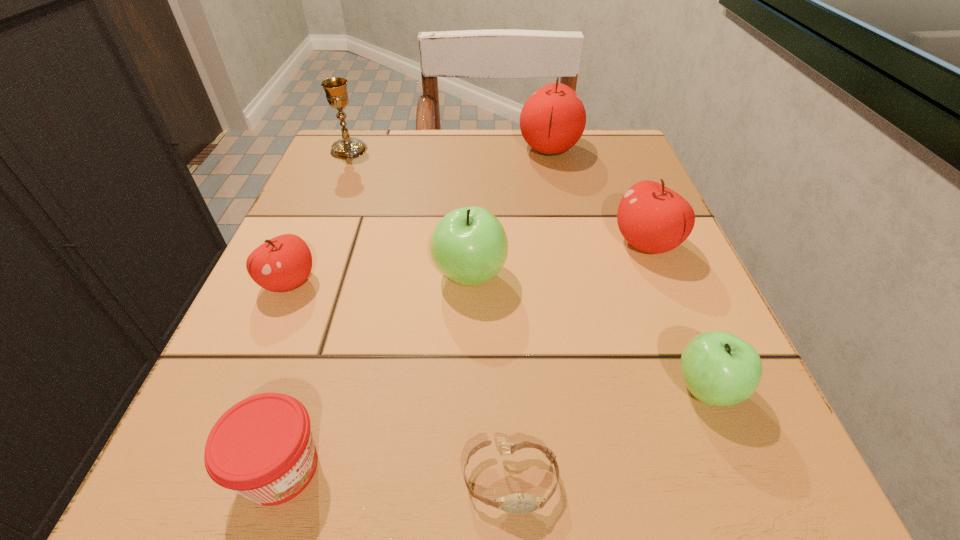
Identify the location of vacant point located between the red jam and the rightmost red apple. The width and height of the screenshot is (960, 540). (464, 355).

Locate an element on the screen. This screenshot has width=960, height=540. empty space that is in between the red jam and the nearer green apple is located at coordinates (493, 428).

You are a GUI agent. You are given a task and a screenshot of the screen. Output one action in this format:
    pyautogui.click(x=<x>, y=<y>)
    Task: Click on the vacant area that lies between the leftmost red apple and the jam
    This screenshot has height=540, width=960.
    Given the screenshot: What is the action you would take?
    pyautogui.click(x=285, y=375)

This screenshot has height=540, width=960. In order to click on free spot between the leftmost apple and the farthest red apple in this screenshot , I will do `click(420, 215)`.

Image resolution: width=960 pixels, height=540 pixels. What are the coordinates of `empty space that is in between the right green apple and the second biggest red apple` in the screenshot? It's located at (676, 316).

Locate an element on the screen. This screenshot has width=960, height=540. free space between the second biggest red apple and the red jam is located at coordinates (464, 355).

Find the location of `free area in between the shortest object and the farther green apple`. free area in between the shortest object and the farther green apple is located at coordinates (490, 378).

Choose which object is the second nearest neighbor to the right green apple. Please provide its 2D coordinates. Your answer should be formatted as a tuple, i.e. [(x, y)], where the tuple contains the x and y coordinates of a point satisfying the conditions above.

[(654, 219)]

Locate which object is the fifth closest to the farthest red apple. Please provide its 2D coordinates. Your answer should be formatted as a tuple, i.e. [(x, y)], where the tuple contains the x and y coordinates of a point satisfying the conditions above.

[(719, 368)]

You are a GUI agent. You are given a task and a screenshot of the screen. Output one action in this format:
    pyautogui.click(x=<x>, y=<y>)
    Task: Click on the apple that is the closest to the farther green apple
    
    Given the screenshot: What is the action you would take?
    pyautogui.click(x=283, y=263)